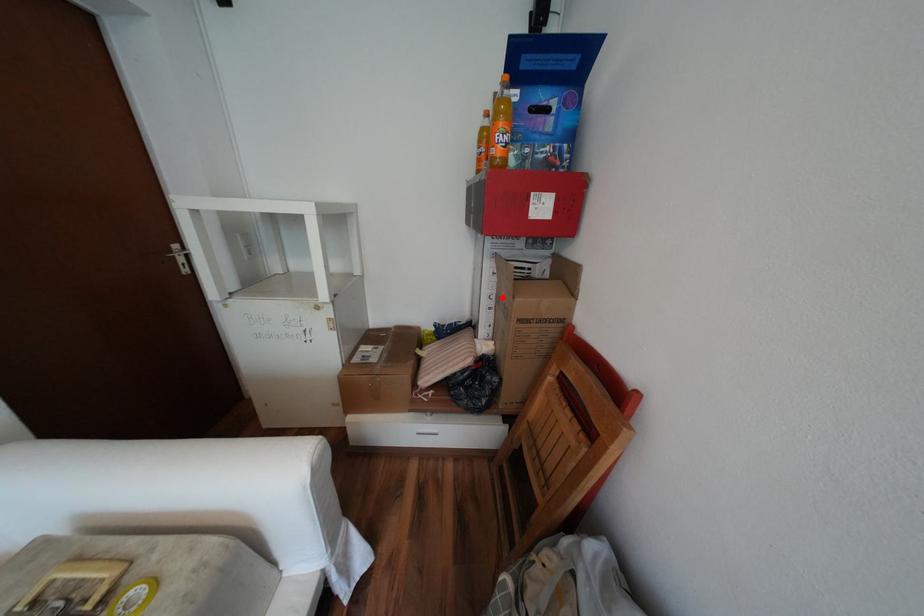
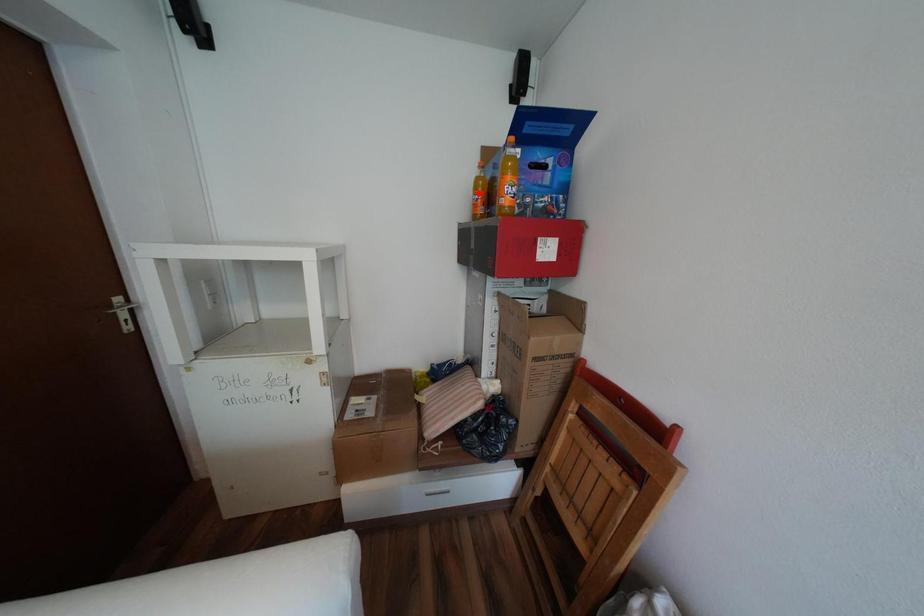
From the picture: I am providing you with two images of the same scene from different viewpoints. A red point is marked on the first image and another point is marked on the second image. Is the marked point in image1 the same physical position as the marked point in image2?

No